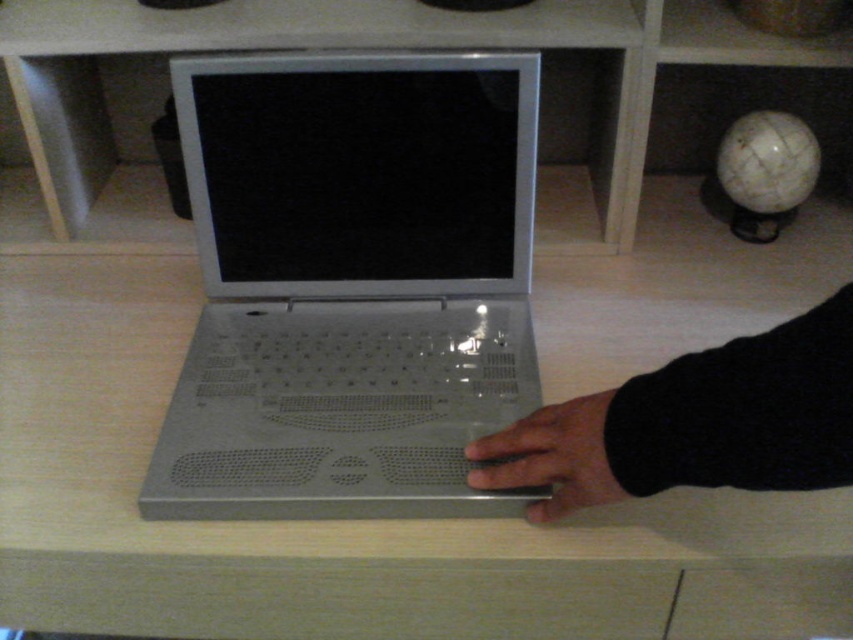
Question: Considering the real-world distances, which object is farthest from the black matte hand at lower right?

Choices:
 (A) black matte hand at center
 (B) matte silver laptop at center

Answer: (B)

Question: Does silver metallic laptop at center have a larger size compared to black matte hand at lower right?

Choices:
 (A) yes
 (B) no

Answer: (B)

Question: Among these points, which one is farthest from the camera?

Choices:
 (A) (479, 76)
 (B) (540, 512)
 (C) (543, 564)
 (D) (672, 420)

Answer: (A)

Question: Among these objects, which one is farthest from the camera?

Choices:
 (A) silver metallic laptop at center
 (B) black matte hand at center

Answer: (A)

Question: Can you confirm if silver metallic laptop at center is wider than black matte hand at center?

Choices:
 (A) yes
 (B) no

Answer: (A)

Question: Considering the relative positions of matte silver laptop at center and black matte hand at lower right in the image provided, where is matte silver laptop at center located with respect to black matte hand at lower right?

Choices:
 (A) below
 (B) above

Answer: (A)